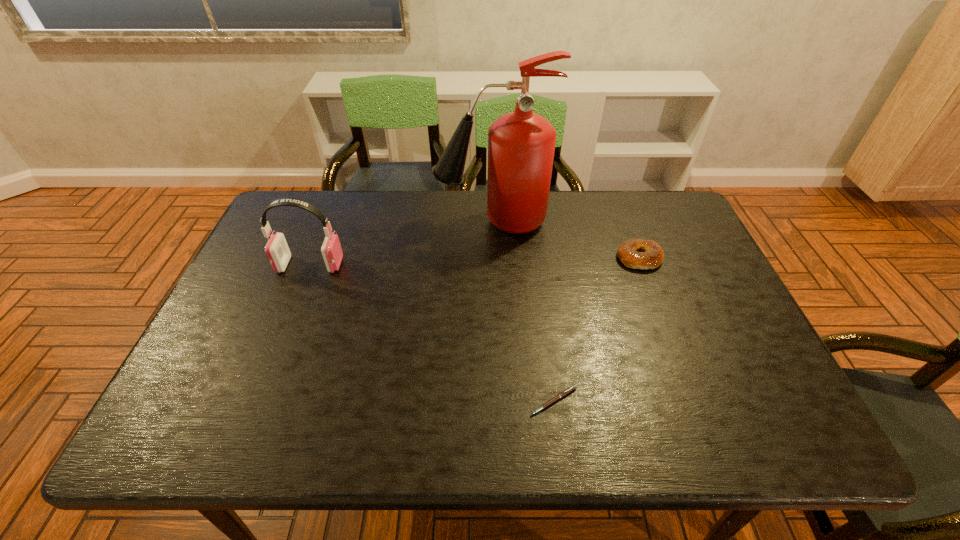
In order to click on the farthest object in this screenshot , I will do `click(521, 144)`.

This screenshot has width=960, height=540. In order to click on fire extinguisher in this screenshot , I will do pyautogui.click(x=521, y=144).

Where is `the second tallest object`? This screenshot has height=540, width=960. the second tallest object is located at coordinates (278, 253).

At what (x,y) coordinates should I click in order to perform the action: click on the leftmost object. Please return your answer as a coordinate pair (x, y). Looking at the image, I should click on (278, 253).

Locate an element on the screen. the rightmost object is located at coordinates (652, 256).

Image resolution: width=960 pixels, height=540 pixels. I want to click on the third tallest object, so click(x=652, y=256).

Identify the location of the shortest object. (572, 388).

Find the location of a particular element. pen is located at coordinates (572, 388).

You are a GUI agent. You are given a task and a screenshot of the screen. Output one action in this format:
    pyautogui.click(x=<x>, y=<y>)
    Task: Click on the vacant area situated 0.260m with the nozzle aimed from the tallest object
    The width and height of the screenshot is (960, 540).
    Given the screenshot: What is the action you would take?
    pyautogui.click(x=354, y=221)

I want to click on vacant point located 0.180m with the nozzle aimed from the tallest object, so (379, 221).